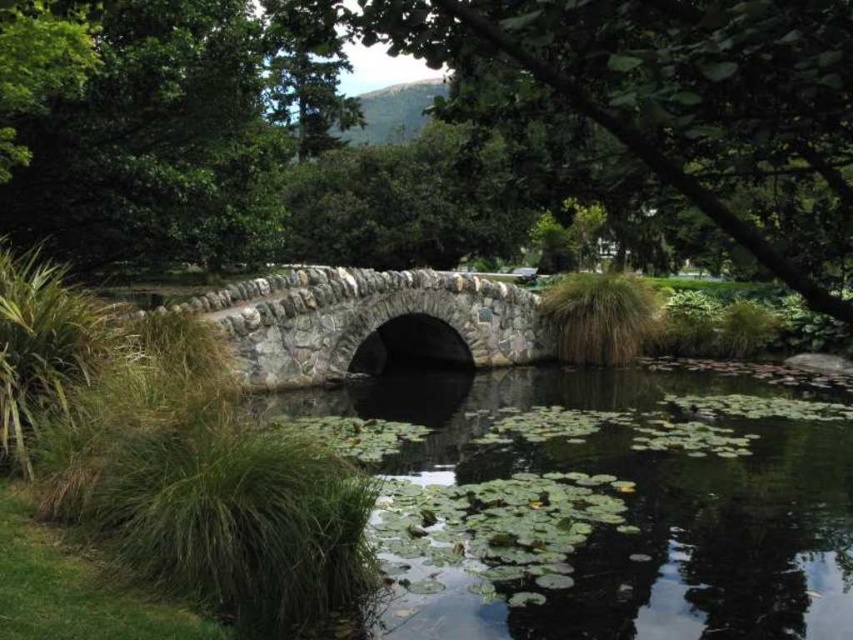
Question: Is green leafy water at center above stone textured bridge at center?

Choices:
 (A) yes
 (B) no

Answer: (B)

Question: Is green leafy water at center to the right of stone textured bridge at center from the viewer's perspective?

Choices:
 (A) yes
 (B) no

Answer: (A)

Question: Among these objects, which one is nearest to the camera?

Choices:
 (A) green leafy water at center
 (B) stone textured bridge at center

Answer: (A)

Question: Can you confirm if green leafy water at center is bigger than stone textured bridge at center?

Choices:
 (A) no
 (B) yes

Answer: (A)

Question: Which object appears farthest from the camera in this image?

Choices:
 (A) stone textured bridge at center
 (B) green leafy water at center

Answer: (A)